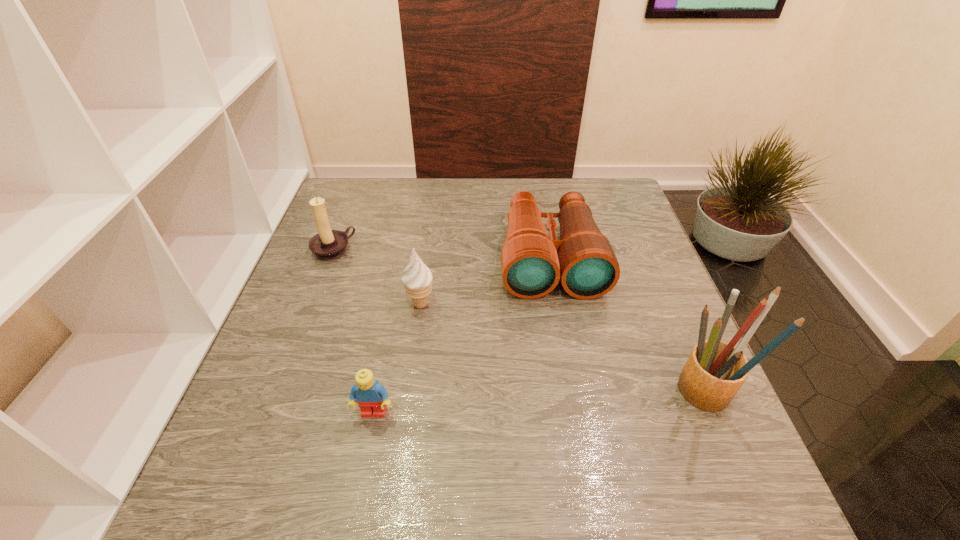
The height and width of the screenshot is (540, 960). Identify the location of Lego. (371, 397).

I want to click on the rightmost object, so click(x=714, y=372).

Locate an element on the screen. The image size is (960, 540). pencil box is located at coordinates coord(714,372).

Where is `the leftmost object`? the leftmost object is located at coordinates (328, 244).

You are a GUI agent. You are given a task and a screenshot of the screen. Output one action in this format:
    pyautogui.click(x=<x>, y=<y>)
    Task: Click on the binoculars
    
    Given the screenshot: What is the action you would take?
    click(532, 263)

Where is `the fourth object from left to right`? The width and height of the screenshot is (960, 540). the fourth object from left to right is located at coordinates (532, 263).

You are a GUI agent. You are given a task and a screenshot of the screen. Output one action in this format:
    pyautogui.click(x=<x>, y=<y>)
    Task: Click on the icecream
    The width and height of the screenshot is (960, 540).
    Given the screenshot: What is the action you would take?
    pyautogui.click(x=417, y=279)

Where is `free region located 0.400m on the back of the rightmost object`? free region located 0.400m on the back of the rightmost object is located at coordinates (642, 240).

Identify the location of vacant space situated 0.190m on the wick of the leftmost object. The image size is (960, 540). (387, 298).

Where is `free space located 0.160m on the wick of the leftmost object`? free space located 0.160m on the wick of the leftmost object is located at coordinates (380, 291).